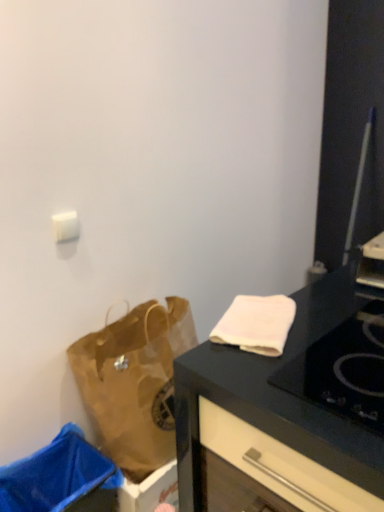
Question: Is brown paper bag at lower left further to the viewer compared to blue plastic trash bin at lower left?

Choices:
 (A) yes
 (B) no

Answer: (A)

Question: Can you confirm if brown paper bag at lower left is taller than blue plastic trash bin at lower left?

Choices:
 (A) no
 (B) yes

Answer: (B)

Question: Is brown paper bag at lower left wider than blue plastic trash bin at lower left?

Choices:
 (A) yes
 (B) no

Answer: (B)

Question: From the image's perspective, is brown paper bag at lower left located beneath blue plastic trash bin at lower left?

Choices:
 (A) yes
 (B) no

Answer: (B)

Question: Can you confirm if brown paper bag at lower left is thinner than blue plastic trash bin at lower left?

Choices:
 (A) no
 (B) yes

Answer: (B)

Question: Considering the positions of point (256, 307) and point (369, 401), is point (256, 307) closer or farther from the camera than point (369, 401)?

Choices:
 (A) closer
 (B) farther

Answer: (B)

Question: From the image's perspective, relative to black glass gas stove at upper right, is white soft towel at upper right above or below?

Choices:
 (A) below
 (B) above

Answer: (B)

Question: Considering the relative positions of white soft towel at upper right and black glass gas stove at upper right in the image provided, is white soft towel at upper right to the left or to the right of black glass gas stove at upper right?

Choices:
 (A) left
 (B) right

Answer: (A)

Question: Is white soft towel at upper right wider or thinner than black glass gas stove at upper right?

Choices:
 (A) wide
 (B) thin

Answer: (B)

Question: Is white soft towel at upper right wider or thinner than brown paper bag at lower left?

Choices:
 (A) wide
 (B) thin

Answer: (B)

Question: Does point (241, 329) appear closer or farther from the camera than point (109, 429)?

Choices:
 (A) closer
 (B) farther

Answer: (A)

Question: Is white soft towel at upper right inside the boundaries of brown paper bag at lower left, or outside?

Choices:
 (A) inside
 (B) outside

Answer: (B)

Question: Visually, is white soft towel at upper right positioned to the left or to the right of brown paper bag at lower left?

Choices:
 (A) left
 (B) right

Answer: (B)

Question: Would you say blue plastic trash bin at lower left is inside or outside white soft towel at upper right?

Choices:
 (A) outside
 (B) inside

Answer: (A)

Question: Is point (31, 482) positioned closer to the camera than point (269, 301)?

Choices:
 (A) closer
 (B) farther

Answer: (B)